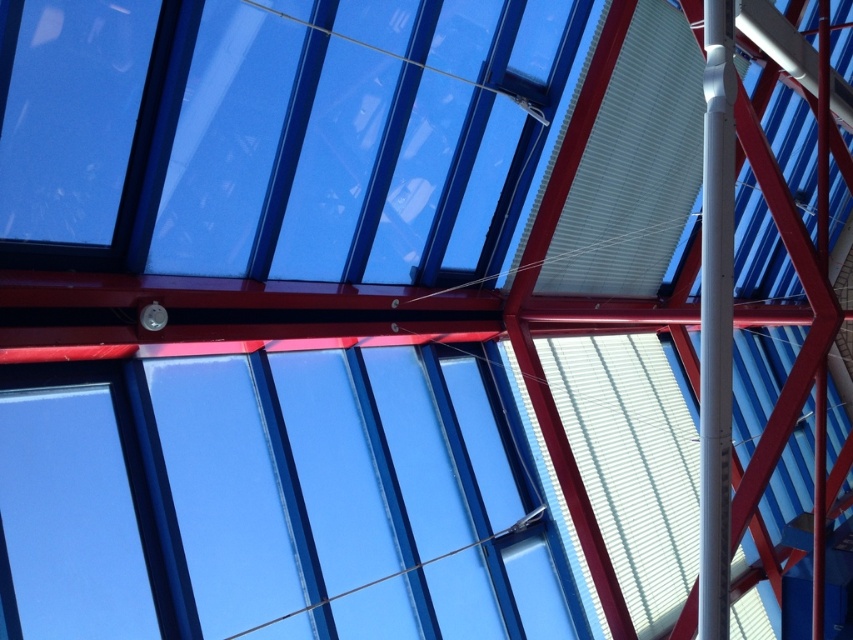
Question: Is transparent glass window at center in front of white glossy pole at center?

Choices:
 (A) no
 (B) yes

Answer: (B)

Question: Is transparent glass window at center to the left of white glossy pole at center from the viewer's perspective?

Choices:
 (A) no
 (B) yes

Answer: (B)

Question: Which object appears farthest from the camera in this image?

Choices:
 (A) white glossy pole at center
 (B) transparent glass window at center

Answer: (A)

Question: Among these objects, which one is farthest from the camera?

Choices:
 (A) white glossy pole at center
 (B) transparent glass window at center

Answer: (A)

Question: In this image, where is transparent glass window at center located relative to white glossy pole at center?

Choices:
 (A) above
 (B) below

Answer: (B)